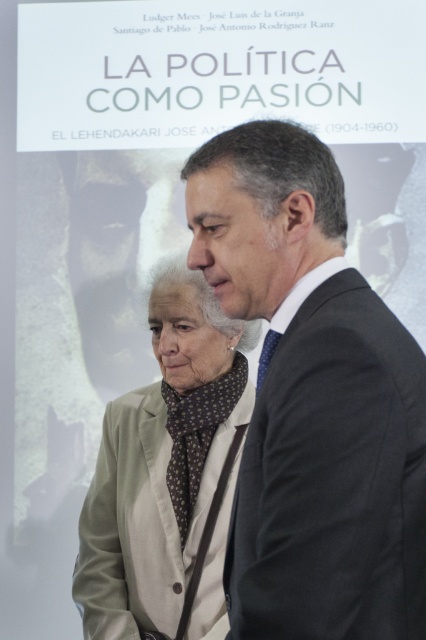
Based on the photo, you are an event organizer setting up a photo shoot for a political event. The background projection says LA POLITICA COMO PASION. You need to position a model wearing the light beige fabric business suit at center in a way that aligns with the event theme. Where should you place the model to emphasize the theme effectively?

The light beige fabric business suit at center should be positioned at point (141, 520) to align with the event theme effectively as specified in the description.

You are a photographer adjusting the focus on your camera. You want to capture a clear image of both the dark gray suit at center and the light beige fabric business suit at center. Which suit should you focus on first to ensure it appears sharp in the photo?

You should focus on the dark gray suit at center first because it is closer to the viewer than the light beige fabric business suit at center, so adjusting focus starting from the closer object ensures both will be in focus.